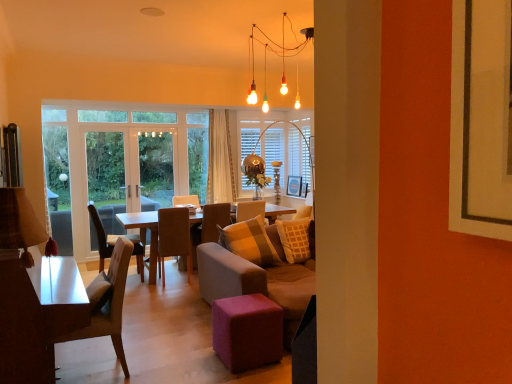
Describe the element at coordinates (258, 280) in the screenshot. I see `velvet beige couch at center` at that location.

You are a GUI agent. You are given a task and a screenshot of the screen. Output one action in this format:
    pyautogui.click(x=<x>, y=<y>)
    Task: Click on the purple fabric stool at center
    This screenshot has height=384, width=512.
    Given the screenshot: What is the action you would take?
    pyautogui.click(x=247, y=331)

Measure the distance between purple fabric stool at center and camera.

purple fabric stool at center and camera are 3.02 meters apart.

The image size is (512, 384). Describe the element at coordinates (114, 242) in the screenshot. I see `brown fabric chair at center, which ranks as the 2th chair in back-to-front order` at that location.

This screenshot has height=384, width=512. Describe the element at coordinates (37, 316) in the screenshot. I see `white glossy table at left` at that location.

What are the coordinates of `clear glass door at center, marked as the 1th screen door in a right-to-left arrangement` in the screenshot? It's located at coord(129,173).

Find the location of a particular element. This screenshot has height=384, width=512. wooden coffee table at center is located at coordinates (144, 234).

Who is shorter, wooden coffee table at center or plush beige pillow at center?

plush beige pillow at center is shorter.

Is wooden coffee table at center aimed at plush beige pillow at center?

No, wooden coffee table at center is not turned towards plush beige pillow at center.

Which of these two, wooden coffee table at center or plush beige pillow at center, is wider?

wooden coffee table at center is wider.

From a real-world perspective, is wooden coffee table at center above or below plush beige pillow at center?

wooden coffee table at center is situated lower than plush beige pillow at center in the real world.

Considering the positions of objects white sheer curtain at center and brown fabric chair at center, which ranks as the 2th chair in back-to-front order, in the image provided, who is more to the right, white sheer curtain at center or brown fabric chair at center, which ranks as the 2th chair in back-to-front order,?

white sheer curtain at center is more to the right.

Based on the photo, from the image's perspective, which one is positioned lower, white sheer curtain at center or brown fabric chair at center, which ranks as the 2th chair in back-to-front order?

brown fabric chair at center, which ranks as the 2th chair in back-to-front order, is shown below in the image.

From a real-world perspective, between white sheer curtain at center and brown fabric chair at center, which ranks as the 2th chair in back-to-front order, who is vertically lower?

brown fabric chair at center, which ranks as the 2th chair in back-to-front order, is physically lower.

Would you say velvet beige couch at center is inside or outside wooden picture frame at center, the first picture frame from the back?

velvet beige couch at center is not inside wooden picture frame at center, the first picture frame from the back, it's outside.

From the image's perspective, is velvet beige couch at center under wooden picture frame at center, the first picture frame from the back?

Yes, from the image's perspective, velvet beige couch at center is beneath wooden picture frame at center, the first picture frame from the back.

Considering the positions of objects velvet beige couch at center and wooden picture frame at center, which is the 2th picture frame from front to back, in the image provided, who is more to the right, velvet beige couch at center or wooden picture frame at center, which is the 2th picture frame from front to back,?

wooden picture frame at center, which is the 2th picture frame from front to back, is more to the right.

What's the angular difference between velvet beige couch at center and wooden picture frame at center, the first picture frame from the back,'s facing directions?

90.5 degrees separate the facing orientations of velvet beige couch at center and wooden picture frame at center, the first picture frame from the back.

From the image's perspective, is white sheer curtain at center positioned above or below purple fabric stool at center?

Clearly, from the image's perspective, white sheer curtain at center is above purple fabric stool at center.

Find the location of a particular element. curtain above the purple fabric stool at center (from the image's perspective) is located at coordinates (220, 159).

Is white sheer curtain at center far from purple fabric stool at center?

Absolutely, white sheer curtain at center is distant from purple fabric stool at center.

Is white sheer curtain at center in front of or behind purple fabric stool at center in the image?

Visually, white sheer curtain at center is located behind purple fabric stool at center.

Is brown fabric chair at center, which ranks as the 2th chair in back-to-front order, at the right side of light brown fabric chair at left, which is the first chair from front to back?

No.

Between brown fabric chair at center, which is the 3th chair from front to back, and light brown fabric chair at left, which is the first chair from front to back, which one has larger size?

With larger size is brown fabric chair at center, which is the 3th chair from front to back.

Can you confirm if brown fabric chair at center, which is the 3th chair from front to back, is taller than light brown fabric chair at left, the 4th chair viewed from the back?

Yes, brown fabric chair at center, which is the 3th chair from front to back, is taller than light brown fabric chair at left, the 4th chair viewed from the back.

Is brown fabric chair at center, which ranks as the 2th chair in back-to-front order, oriented towards light brown fabric chair at left, which is the first chair from front to back?

No, brown fabric chair at center, which ranks as the 2th chair in back-to-front order, is not facing towards light brown fabric chair at left, which is the first chair from front to back.

From a real-world perspective, which object rests below the other?

From a 3D spatial view, light brown fabric chair at left, which is the first chair from front to back, is below.

Is light brown fabric chair at left, the 4th chair viewed from the back, in front of or behind brown fabric chair at center, which ranks as the 2th chair in back-to-front order, in the image?

In the image, light brown fabric chair at left, the 4th chair viewed from the back, appears in front of brown fabric chair at center, which ranks as the 2th chair in back-to-front order.

Which is closer to the camera, [94,313] or [137,248]?

Point [94,313] appears to be closer to the viewer than point [137,248].

Who is bigger, light brown fabric chair at left, the 4th chair viewed from the back, or brown fabric chair at center, which ranks as the 2th chair in back-to-front order?

Bigger between the two is brown fabric chair at center, which ranks as the 2th chair in back-to-front order.

Is white glossy table at left touching purple fabric stool at center?

No, white glossy table at left is not next to purple fabric stool at center.

From the image's perspective, is white glossy table at left positioned above or below purple fabric stool at center?

Clearly, from the image's perspective, white glossy table at left is above purple fabric stool at center.

Does white glossy table at left come behind purple fabric stool at center?

No, it is in front of purple fabric stool at center.

Identify the location of stool lying behind the white glossy table at left. (247, 331).

You are a GUI agent. You are given a task and a screenshot of the screen. Output one action in this format:
    pyautogui.click(x=<x>, y=<y>)
    Task: Click on the pillow above the wooden coffee table at center (from a real-world perspective)
    This screenshot has width=512, height=384.
    Given the screenshot: What is the action you would take?
    pyautogui.click(x=303, y=212)

Find the location of a particular element. This screenshot has width=512, height=384. curtain behind the brown fabric chair at center, which ranks as the 2th chair in back-to-front order is located at coordinates (220, 159).

Looking at the image, which one is located further to wooden picture frame at center, which is the 2th picture frame from front to back, wooden coffee table at center or velvet beige couch at center?

Among the two, velvet beige couch at center is located further to wooden picture frame at center, which is the 2th picture frame from front to back.

When comparing their distances from wooden coffee table at center, does velvet brown chair at center, which is counted as the fourth chair, starting from the front, or translucent glass window at center seem closer?

velvet brown chair at center, which is counted as the fourth chair, starting from the front, is positioned closer to the anchor wooden coffee table at center.

Based on their spatial positions, is plush beige pillow at center or wooden coffee table at center further from white sheer curtain at center?

plush beige pillow at center is positioned further to the anchor white sheer curtain at center.

Looking at the image, which one is located closer to wooden coffee table at center, brown fabric chair at center, arranged as the 3th chair when viewed from the back, or plush beige pillow at center?

brown fabric chair at center, arranged as the 3th chair when viewed from the back, is closer to wooden coffee table at center.

Estimate the real-world distances between objects in this image. Which object is further from transparent glass door at left, placed as the 1th screen door when sorted from left to right, white sheer curtain at center or light brown fabric chair at left, which is the first chair from front to back?

The object further to transparent glass door at left, placed as the 1th screen door when sorted from left to right, is light brown fabric chair at left, which is the first chair from front to back.

Looking at the image, which one is located closer to translucent glass window at center, wooden picture frame at center, positioned as the 2th picture frame in back-to-front order, or transparent glass door at left, placed as the second screen door when sorted from right to left?

wooden picture frame at center, positioned as the 2th picture frame in back-to-front order, is closer to translucent glass window at center.

From the image, which object appears to be farther from plush beige pillow at center, wooden picture frame at center, which is counted as the 1th picture frame, starting from the front, or velvet beige couch at center?

wooden picture frame at center, which is counted as the 1th picture frame, starting from the front.

Consider the image. When comparing their distances from plush beige pillow at center, does brown fabric chair at center, which is the 3th chair from front to back, or white sheer curtain at center seem further?

Among the two, brown fabric chair at center, which is the 3th chair from front to back, is located further to plush beige pillow at center.

Identify the location of pillow between brown fabric chair at center, which ranks as the 2th chair in back-to-front order, and wooden picture frame at center, which is counted as the 1th picture frame, starting from the front. The image size is (512, 384). (303, 212).

Where is `window between brown fabric chair at center, which is the 3th chair from front to back, and wooden picture frame at center, which is counted as the 1th picture frame, starting from the front`? window between brown fabric chair at center, which is the 3th chair from front to back, and wooden picture frame at center, which is counted as the 1th picture frame, starting from the front is located at coordinates (278, 145).

What are the coordinates of `pillow located between brown fabric chair at center, which is the 2th chair from front to back, and wooden picture frame at center, which is the 2th picture frame from front to back, in the depth direction` in the screenshot? It's located at (303, 212).

Locate an element on the screen. Image resolution: width=512 pixels, height=384 pixels. stool between white glossy table at left and translucent glass window at center from front to back is located at coordinates (247, 331).